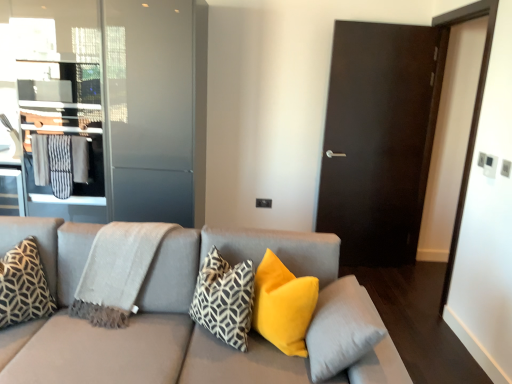
Question: Does geometric-patterned fabric pillow at center, the 3th pillow in the right-to-left sequence, appear on the right side of metallic glass elevator at left?

Choices:
 (A) yes
 (B) no

Answer: (A)

Question: Is geometric-patterned fabric pillow at center, the 2th pillow when ordered from left to right, surrounding metallic glass elevator at left?

Choices:
 (A) no
 (B) yes

Answer: (A)

Question: Can you confirm if geometric-patterned fabric pillow at center, the 3th pillow in the right-to-left sequence, is taller than metallic glass elevator at left?

Choices:
 (A) no
 (B) yes

Answer: (A)

Question: Could you tell me if geometric-patterned fabric pillow at center, the 3th pillow in the right-to-left sequence, is turned towards metallic glass elevator at left?

Choices:
 (A) yes
 (B) no

Answer: (B)

Question: Is geometric-patterned fabric pillow at center, the 3th pillow in the right-to-left sequence, positioned beyond the bounds of metallic glass elevator at left?

Choices:
 (A) yes
 (B) no

Answer: (A)

Question: Is geometric-patterned fabric pillow at center, the 3th pillow in the right-to-left sequence, oriented away from metallic glass elevator at left?

Choices:
 (A) no
 (B) yes

Answer: (A)

Question: From a real-world perspective, is matte gray couch at center positioned over velvet yellow pillow at center, placed as the third pillow when sorted from left to right, based on gravity?

Choices:
 (A) yes
 (B) no

Answer: (B)

Question: Are matte gray couch at center and velvet yellow pillow at center, marked as the second pillow in a right-to-left arrangement, beside each other?

Choices:
 (A) no
 (B) yes

Answer: (A)

Question: Is matte gray couch at center thinner than velvet yellow pillow at center, placed as the third pillow when sorted from left to right?

Choices:
 (A) no
 (B) yes

Answer: (A)

Question: Is the depth of matte gray couch at center less than that of velvet yellow pillow at center, placed as the third pillow when sorted from left to right?

Choices:
 (A) yes
 (B) no

Answer: (A)

Question: Can you confirm if matte gray couch at center is wider than velvet yellow pillow at center, placed as the third pillow when sorted from left to right?

Choices:
 (A) yes
 (B) no

Answer: (A)

Question: Is matte gray couch at center outside of velvet yellow pillow at center, marked as the second pillow in a right-to-left arrangement?

Choices:
 (A) no
 (B) yes

Answer: (B)

Question: Is velvet yellow pillow at center, placed as the third pillow when sorted from left to right, not close to geometric-patterned fabric pillow at center, the 2th pillow when ordered from left to right?

Choices:
 (A) yes
 (B) no

Answer: (B)